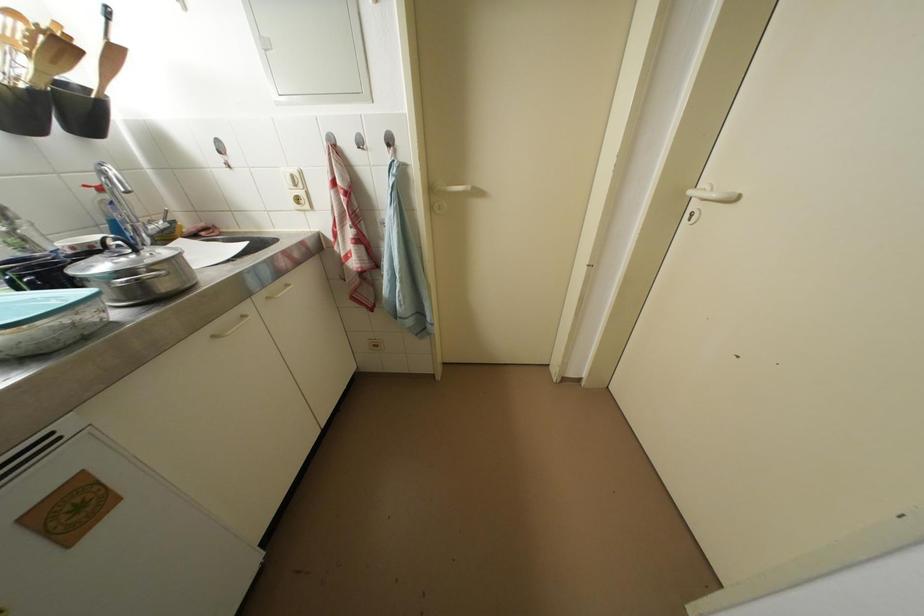
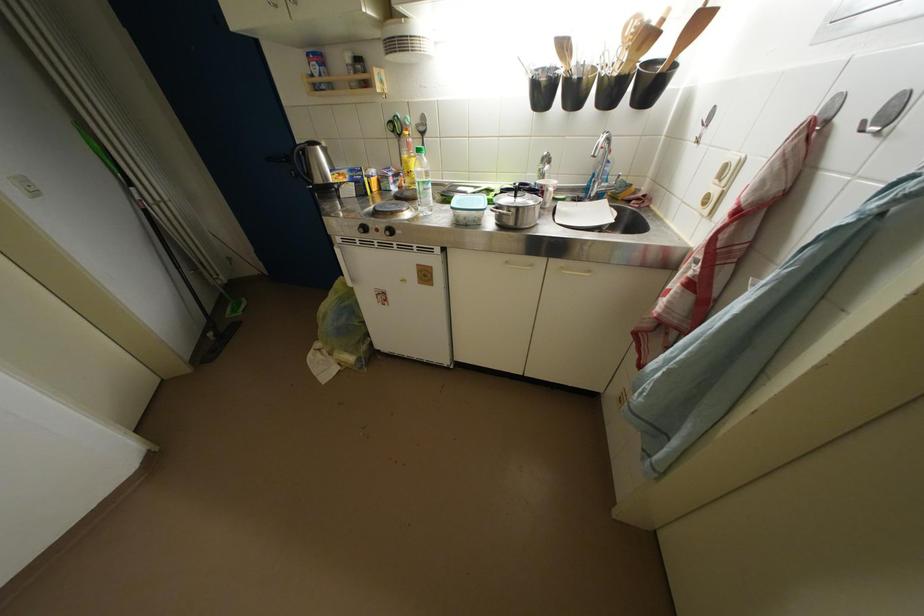
In the second image, find the point that corresponds to point (366, 151) in the first image.

(869, 132)